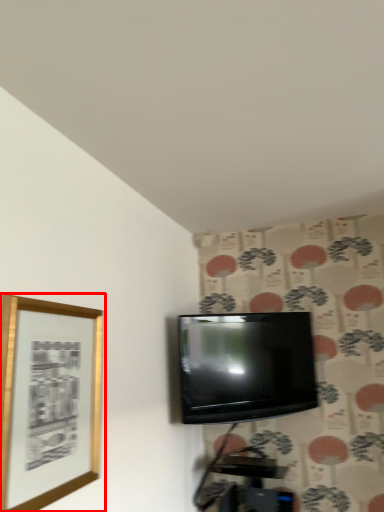
Question: From the image's perspective, where is picture frame (annotated by the red box) located in relation to television in the image?

Choices:
 (A) below
 (B) above

Answer: (B)